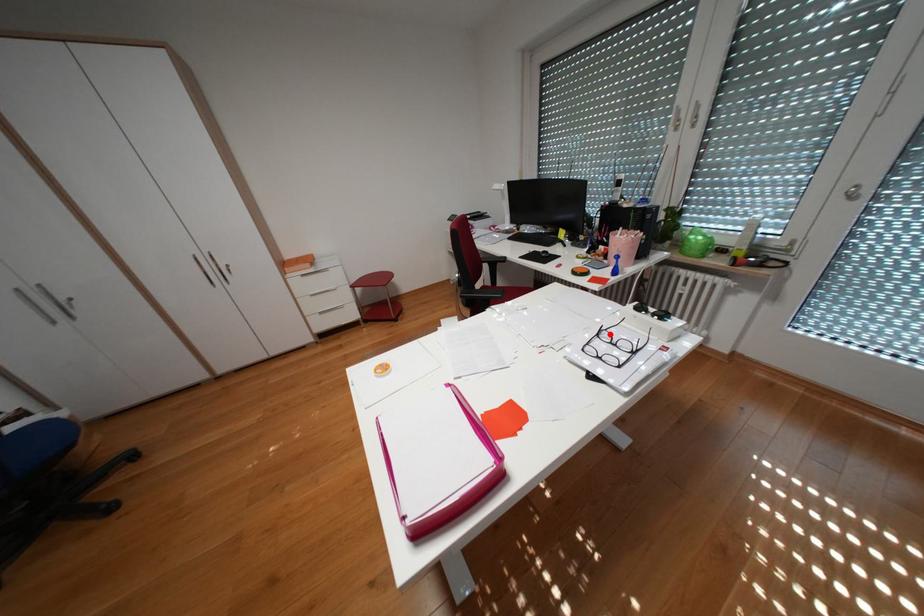
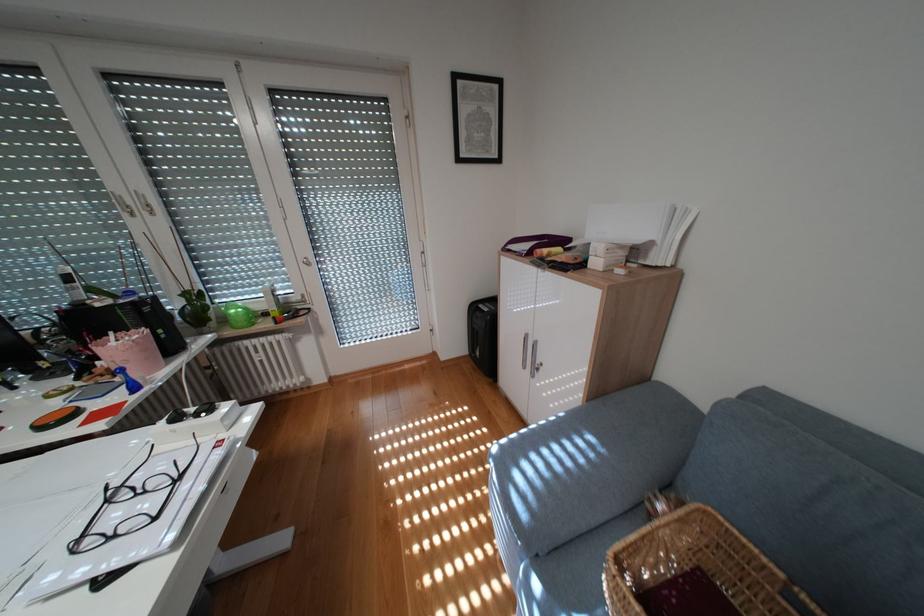
Locate, in the second image, the point that corresponds to the highlighted location in the first image.

(119, 501)